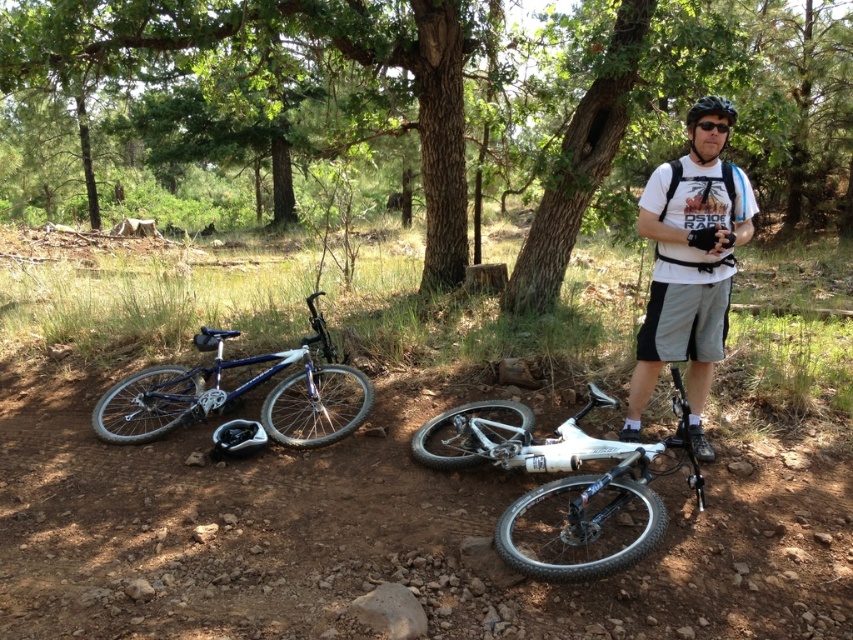
Does white matte t-shirt at center appear on the right side of shiny blue matte mountain bike at lower left?

Yes, white matte t-shirt at center is to the right of shiny blue matte mountain bike at lower left.

Does white matte t-shirt at center appear under shiny blue matte mountain bike at lower left?

Actually, white matte t-shirt at center is above shiny blue matte mountain bike at lower left.

Is point (733, 273) behind point (206, 342)?

No, it is not.

You are a GUI agent. You are given a task and a screenshot of the screen. Output one action in this format:
    pyautogui.click(x=<x>, y=<y>)
    Task: Click on the white matte t-shirt at center
    The width and height of the screenshot is (853, 640).
    Given the screenshot: What is the action you would take?
    pyautogui.click(x=689, y=266)

Who is more distant from viewer, (795, 522) or (654, 328)?

Point (654, 328)

Is point (698, 628) positioned after point (689, 259)?

No.

The width and height of the screenshot is (853, 640). In order to click on dirt track at lower center in this screenshot , I will do `click(381, 536)`.

Based on the photo, which of these two, green leafy tree at center or shiny blue matte mountain bike at lower left, stands taller?

green leafy tree at center is taller.

The width and height of the screenshot is (853, 640). What do you see at coordinates (431, 108) in the screenshot?
I see `green leafy tree at center` at bounding box center [431, 108].

Locate an element on the screen. This screenshot has width=853, height=640. green leafy tree at center is located at coordinates (431, 108).